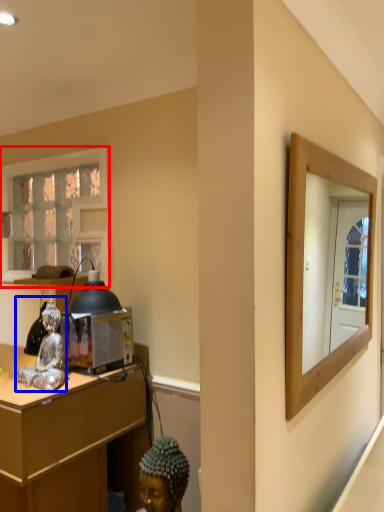
Question: Which of the following is the closest to the observer, window (highlighted by a red box) or figurine (highlighted by a blue box)?

Choices:
 (A) window
 (B) figurine

Answer: (B)